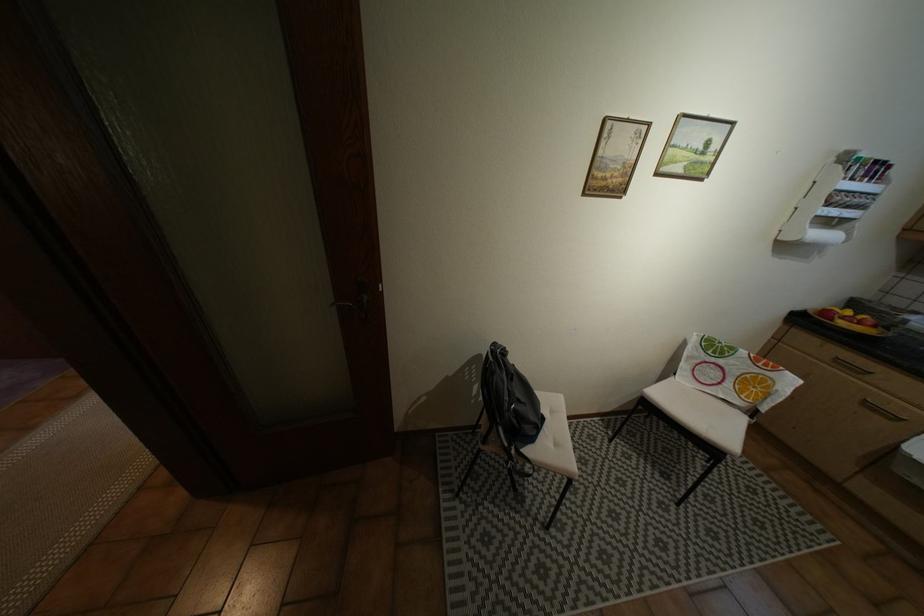
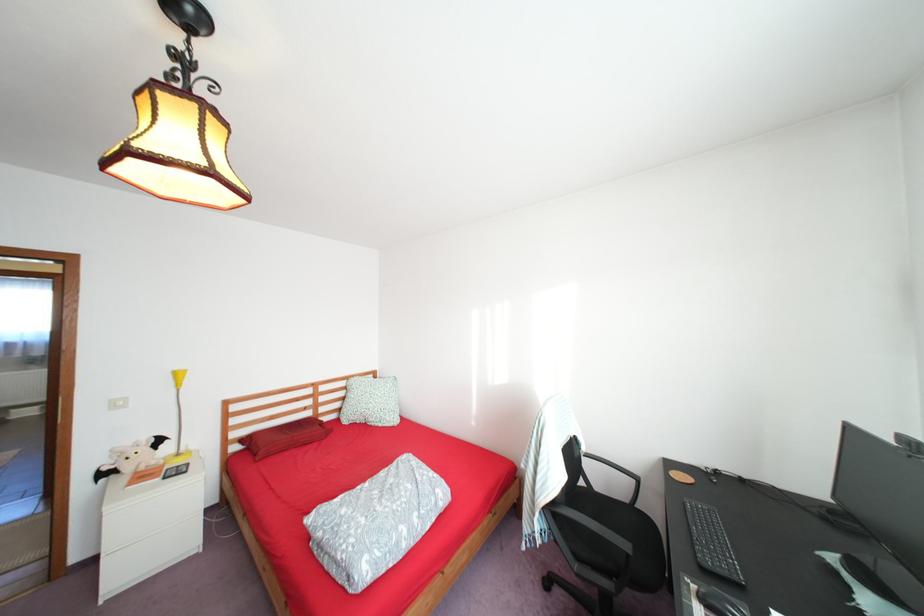
Question: I am providing you with two images of the same scene from different viewpoints. Which of the following objects are not visible in image2?

Choices:
 (A) black broom
 (B) bat plush toy
 (C) chair sitting surface
 (D) black chair armrest

Answer: (C)